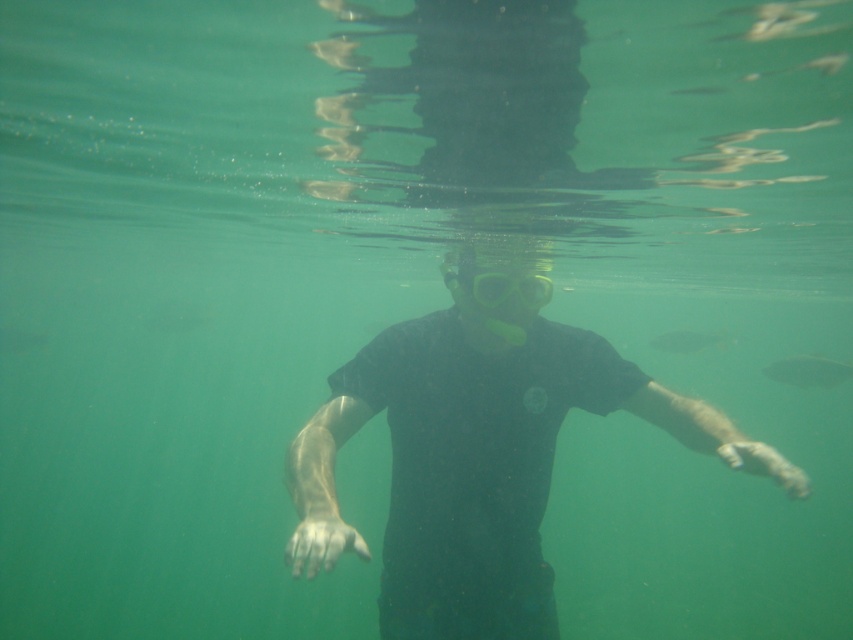
You are a diver who wants to reach the point at coordinates point [512,465]. Given that you can swim 15 feet per minute, how long will it take you to reach the point?

The point at coordinates point [512,465] is 14.98 feet away from you. Since you can swim 15 feet per minute, it will take approximately 1 minute to reach the point.